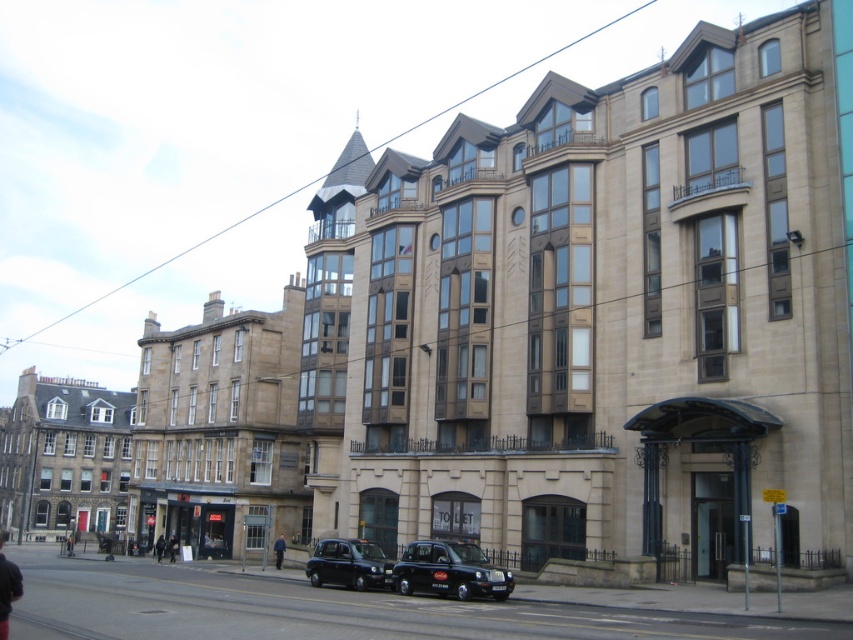
Which is behind, point (428, 579) or point (318, 541)?

The point (318, 541) is behind.

Consider the image. Who is taller, black metallic taxi at center or matte black taxi at center?

matte black taxi at center is taller.

At what (x,y) coordinates should I click in order to perform the action: click on black metallic taxi at center. Please return your answer as a coordinate pair (x, y). Image resolution: width=853 pixels, height=640 pixels. Looking at the image, I should click on (450, 572).